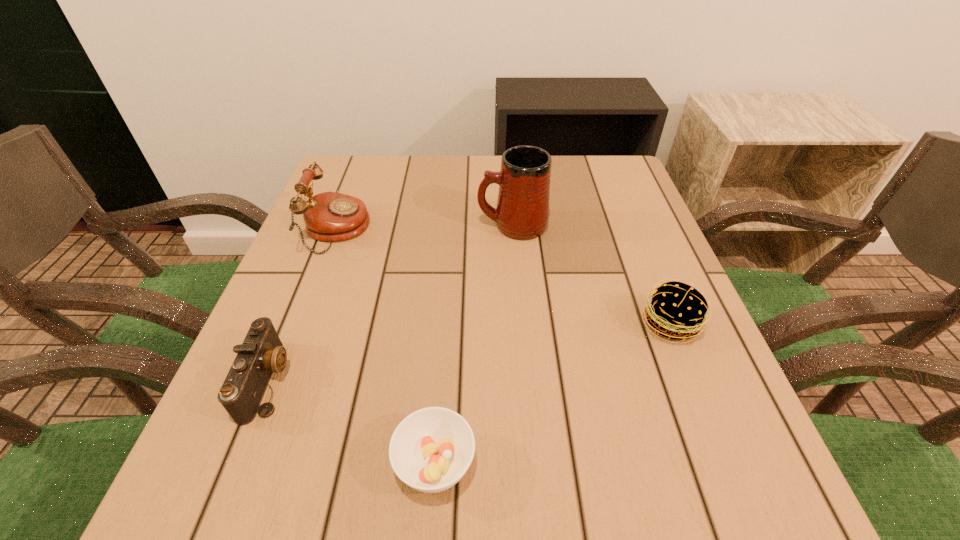
Where is `vacant position located on the dial of the telephone`? This screenshot has width=960, height=540. vacant position located on the dial of the telephone is located at coordinates (459, 230).

This screenshot has width=960, height=540. Identify the location of vacant space located on the back of the rightmost object. (653, 280).

The height and width of the screenshot is (540, 960). Identify the location of vacant space situated 0.290m on the front-facing side of the camera. (464, 380).

What are the coordinates of `vacant space located 0.300m on the back of the nearest object` in the screenshot? It's located at (448, 286).

The width and height of the screenshot is (960, 540). Identify the location of object at the far edge. (330, 216).

Identify the location of object at the near edge. Image resolution: width=960 pixels, height=540 pixels. (431, 449).

What are the coordinates of `telephone positioned at the left edge` in the screenshot? It's located at (330, 216).

At what (x,y) coordinates should I click in order to perform the action: click on camera present at the left edge. Please return your answer as a coordinate pair (x, y). Image resolution: width=960 pixels, height=540 pixels. Looking at the image, I should click on (261, 353).

Find the location of a particular element. The height and width of the screenshot is (540, 960). object that is at the right edge is located at coordinates (677, 310).

Image resolution: width=960 pixels, height=540 pixels. In order to click on object at the far left corner in this screenshot , I will do `click(330, 216)`.